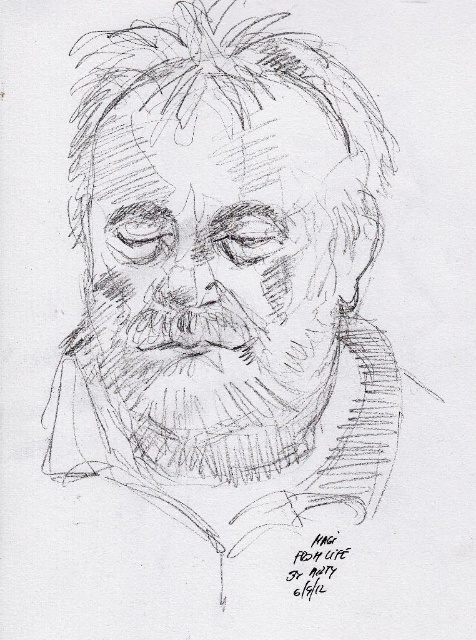
Question: In this image, where is pencil sketch face at center located relative to shaggy pencil beard at center?

Choices:
 (A) below
 (B) above

Answer: (B)

Question: Which point is farther to the camera?

Choices:
 (A) (105, 148)
 (B) (109, 292)

Answer: (B)

Question: Can you confirm if pencil sketch face at center is positioned to the right of shaggy pencil beard at center?

Choices:
 (A) yes
 (B) no

Answer: (A)

Question: In this image, where is pencil sketch face at center located relative to shaggy pencil beard at center?

Choices:
 (A) below
 (B) above

Answer: (B)

Question: Which of the following is the closest to the observer?

Choices:
 (A) (179, 392)
 (B) (200, 209)

Answer: (B)